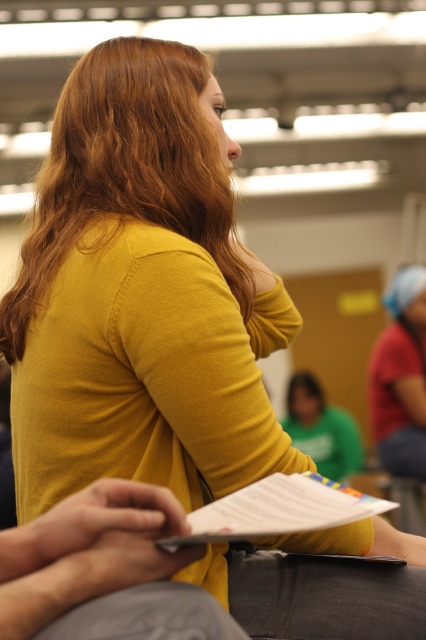
You are sitting in a classroom and see the golden smooth hair at upper center and the white paper at center. Which object is closer to you?

The golden smooth hair at upper center is closer to you because it is further to the viewer than the white paper at center.

You are sitting in a classroom and see the golden smooth hair at upper center and the white paper at center. Which object is positioned higher in the image?

The golden smooth hair at upper center is located above the white paper at center, so it is positioned higher.